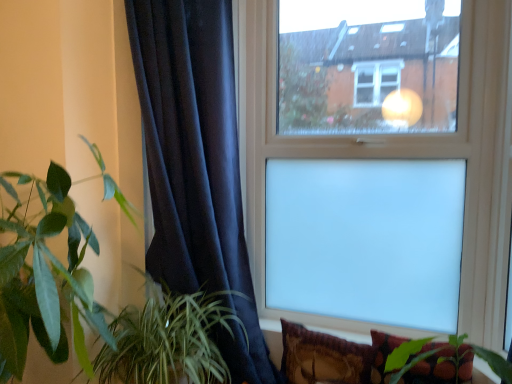
Question: Can you confirm if velvet-like brown pillow at lower right, positioned as the 2th pillow in right-to-left order, is taller than transparent glass window at upper center?

Choices:
 (A) yes
 (B) no

Answer: (B)

Question: Is velvet-like brown pillow at lower right, placed as the 1th pillow when sorted from left to right, not within transparent glass window at upper center?

Choices:
 (A) yes
 (B) no

Answer: (A)

Question: Is velvet-like brown pillow at lower right, placed as the 1th pillow when sorted from left to right, bigger than transparent glass window at upper center?

Choices:
 (A) yes
 (B) no

Answer: (B)

Question: Is velvet-like brown pillow at lower right, positioned as the 2th pillow in right-to-left order, facing towards transparent glass window at upper center?

Choices:
 (A) no
 (B) yes

Answer: (A)

Question: Can you confirm if velvet-like brown pillow at lower right, positioned as the 2th pillow in right-to-left order, is smaller than transparent glass window at upper center?

Choices:
 (A) no
 (B) yes

Answer: (B)

Question: Is point (93, 327) positioned closer to the camera than point (190, 362)?

Choices:
 (A) closer
 (B) farther

Answer: (A)

Question: Considering the positions of green leafy plant at left, acting as the first houseplant starting from the left, and green leafy plant at lower left, positioned as the second houseplant in left-to-right order, in the image, is green leafy plant at left, acting as the first houseplant starting from the left, taller or shorter than green leafy plant at lower left, positioned as the second houseplant in left-to-right order,?

Choices:
 (A) tall
 (B) short

Answer: (A)

Question: Is green leafy plant at left, acting as the first houseplant starting from the left, spatially inside green leafy plant at lower left, positioned as the second houseplant in left-to-right order, or outside of it?

Choices:
 (A) inside
 (B) outside

Answer: (B)

Question: From a real-world perspective, is green leafy plant at left, which is the 2th houseplant in right-to-left order, physically located above or below green leafy plant at lower left, positioned as the second houseplant in left-to-right order?

Choices:
 (A) above
 (B) below

Answer: (A)

Question: In the image, is green leafy plant at left, acting as the first houseplant starting from the left, on the left side or the right side of velvet-like brown pillow at lower right, placed as the 1th pillow when sorted from left to right?

Choices:
 (A) left
 (B) right

Answer: (A)

Question: From their relative heights in the image, would you say green leafy plant at left, which is the 2th houseplant in right-to-left order, is taller or shorter than velvet-like brown pillow at lower right, positioned as the 2th pillow in right-to-left order?

Choices:
 (A) short
 (B) tall

Answer: (B)

Question: From the image's perspective, is green leafy plant at left, acting as the first houseplant starting from the left, positioned above or below velvet-like brown pillow at lower right, placed as the 1th pillow when sorted from left to right?

Choices:
 (A) below
 (B) above

Answer: (B)

Question: Considering the positions of point (82, 369) and point (368, 345), is point (82, 369) closer or farther from the camera than point (368, 345)?

Choices:
 (A) farther
 (B) closer

Answer: (B)

Question: Which is correct: velvet floral pillow at lower right, which is counted as the first pillow, starting from the right, is inside velvet dark blue curtain at left, or outside of it?

Choices:
 (A) outside
 (B) inside

Answer: (A)

Question: From a real-world perspective, relative to velvet dark blue curtain at left, is velvet floral pillow at lower right, the 2th pillow positioned from the left, vertically above or below?

Choices:
 (A) above
 (B) below

Answer: (B)